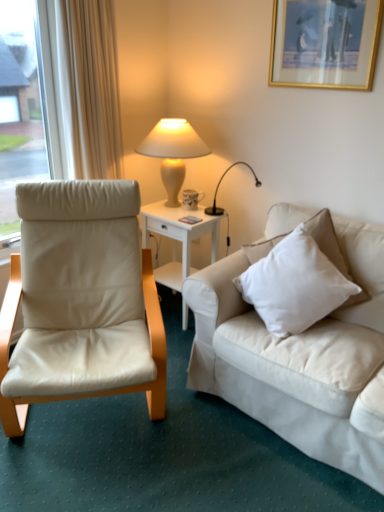
Question: From a real-world perspective, is beige leather chair at left positioned above or below gold-framed picture at upper right?

Choices:
 (A) above
 (B) below

Answer: (B)

Question: Is beige leather chair at left wider or thinner than gold-framed picture at upper right?

Choices:
 (A) wide
 (B) thin

Answer: (A)

Question: Estimate the real-world distances between objects in this image. Which object is farther from the white glossy side table at center?

Choices:
 (A) matte beige lamp at upper center
 (B) porcelain floral mug at side table
 (C) gold-framed picture at upper right
 (D) white cotton pillow at right
 (E) beige leather chair at left

Answer: (C)

Question: Which is farther from the porcelain floral mug at side table?

Choices:
 (A) white glossy side table at center
 (B) white cotton pillow at right
 (C) gold-framed picture at upper right
 (D) beige leather chair at left
 (E) matte beige lamp at upper center

Answer: (C)